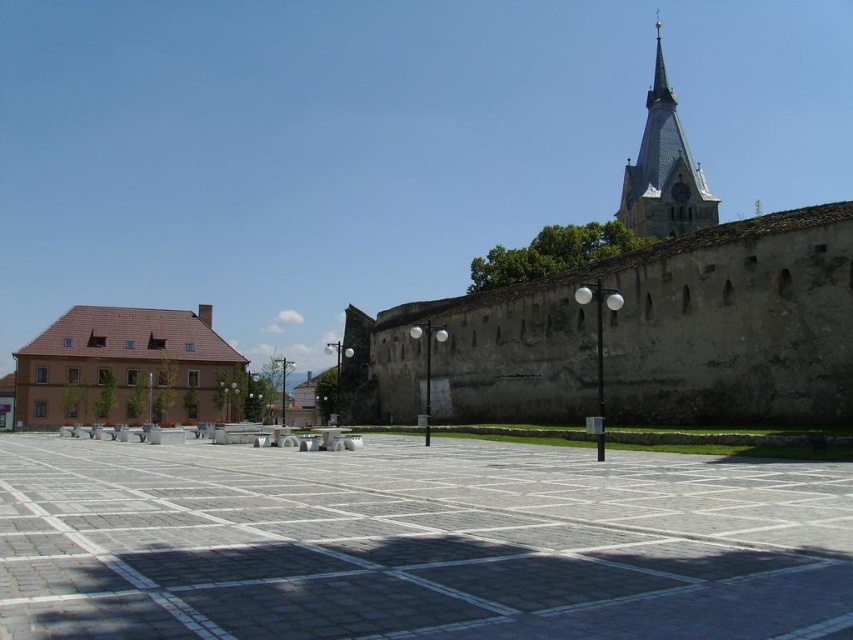
Question: Which of these objects is positioned closest to the brown matte building at left?

Choices:
 (A) light brown stone clock tower at upper right
 (B) gray concrete tiles at center

Answer: (B)

Question: From the image, what is the correct spatial relationship of brown matte building at left in relation to light brown stone clock tower at upper right?

Choices:
 (A) right
 (B) left

Answer: (B)

Question: Does brown matte building at left have a larger size compared to light brown stone clock tower at upper right?

Choices:
 (A) no
 (B) yes

Answer: (A)

Question: Based on their relative distances, which object is nearer to the gray concrete tiles at center?

Choices:
 (A) light brown stone clock tower at upper right
 (B) brown matte building at left

Answer: (B)

Question: From the image, what is the correct spatial relationship of brown matte building at left in relation to light brown stone clock tower at upper right?

Choices:
 (A) right
 (B) left

Answer: (B)

Question: Which object appears closest to the camera in this image?

Choices:
 (A) light brown stone clock tower at upper right
 (B) gray concrete tiles at center

Answer: (B)